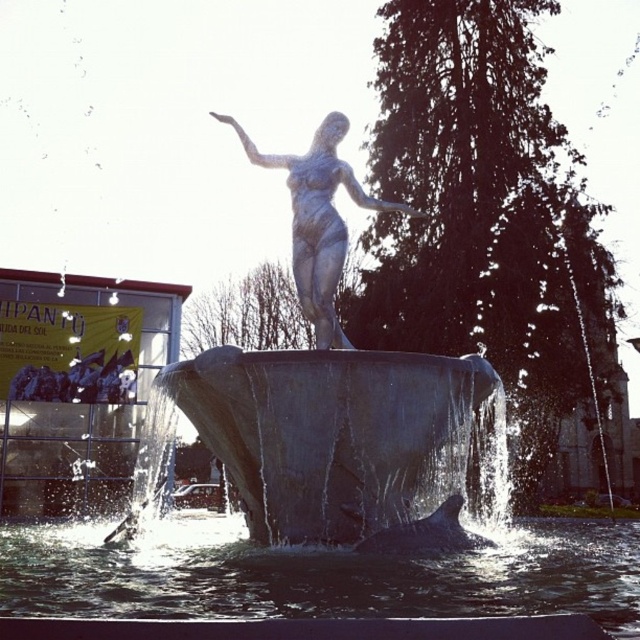
Question: Does clear water at center appear on the left side of satin silver statue at center?

Choices:
 (A) yes
 (B) no

Answer: (A)

Question: Is clear water at center to the left of satin silver statue at center from the viewer's perspective?

Choices:
 (A) no
 (B) yes

Answer: (B)

Question: Which object is closer to the camera taking this photo?

Choices:
 (A) satin silver statue at center
 (B) clear water at center

Answer: (B)

Question: Is clear water at center to the left of satin silver statue at center from the viewer's perspective?

Choices:
 (A) no
 (B) yes

Answer: (B)